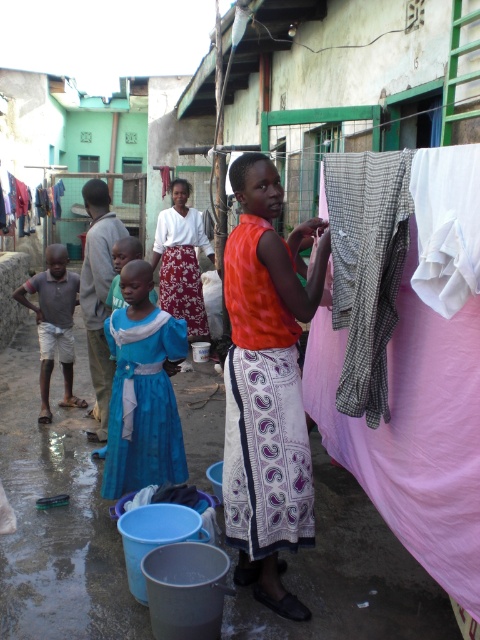
Is orange fabric dress at center to the right of matte gray shirt at left from the viewer's perspective?

Indeed, orange fabric dress at center is positioned on the right side of matte gray shirt at left.

Is orange fabric dress at center positioned behind matte gray shirt at left?

No, orange fabric dress at center is closer to the viewer.

Which is in front, point (249, 522) or point (49, 349)?

Point (249, 522) is more forward.

Where is `orange fabric dress at center`? orange fabric dress at center is located at coordinates (266, 387).

Can you confirm if matte gray shirt at left is taller than blue satin dress at center?

Indeed, matte gray shirt at left has a greater height compared to blue satin dress at center.

Can you confirm if matte gray shirt at left is shorter than blue satin dress at center?

No.

What do you see at coordinates (54, 323) in the screenshot? I see `matte gray shirt at left` at bounding box center [54, 323].

In order to click on matte gray shirt at left in this screenshot , I will do `click(54, 323)`.

Can you confirm if orange fabric dress at center is taller than white printed fabric dress at center?

Yes.

Can you confirm if orange fabric dress at center is positioned below white printed fabric dress at center?

Yes.

This screenshot has height=640, width=480. What do you see at coordinates (266, 387) in the screenshot? I see `orange fabric dress at center` at bounding box center [266, 387].

At what (x,y) coordinates should I click in order to perform the action: click on orange fabric dress at center. Please return your answer as a coordinate pair (x, y). The image size is (480, 640). Looking at the image, I should click on (266, 387).